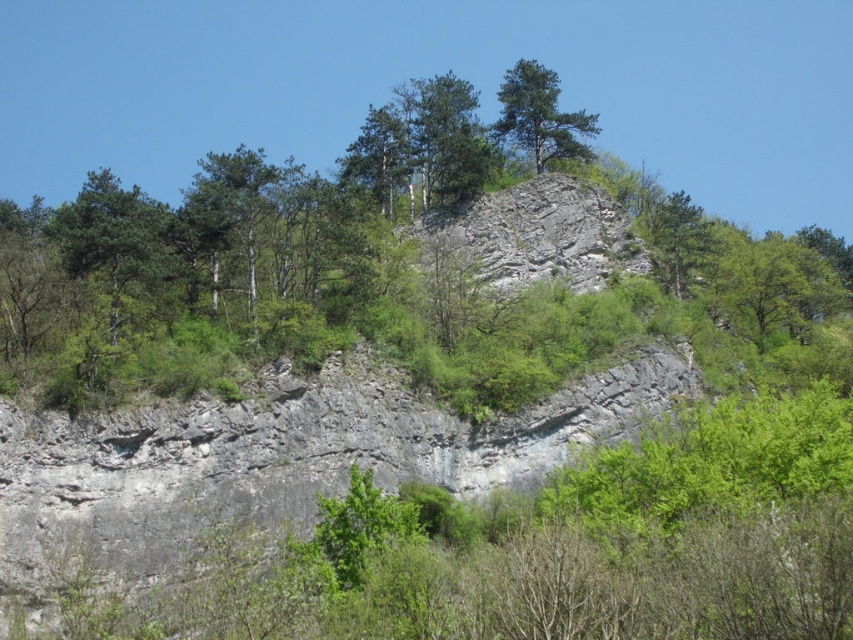
Does green matte tree at upper left lie in front of green matte tree at upper center?

That is True.

At what (x,y) coordinates should I click in order to perform the action: click on green matte tree at upper left. Please return your answer as a coordinate pair (x, y). This screenshot has height=640, width=853. Looking at the image, I should click on point(112,237).

Where is `green matte tree at upper left`? green matte tree at upper left is located at coordinates (112, 237).